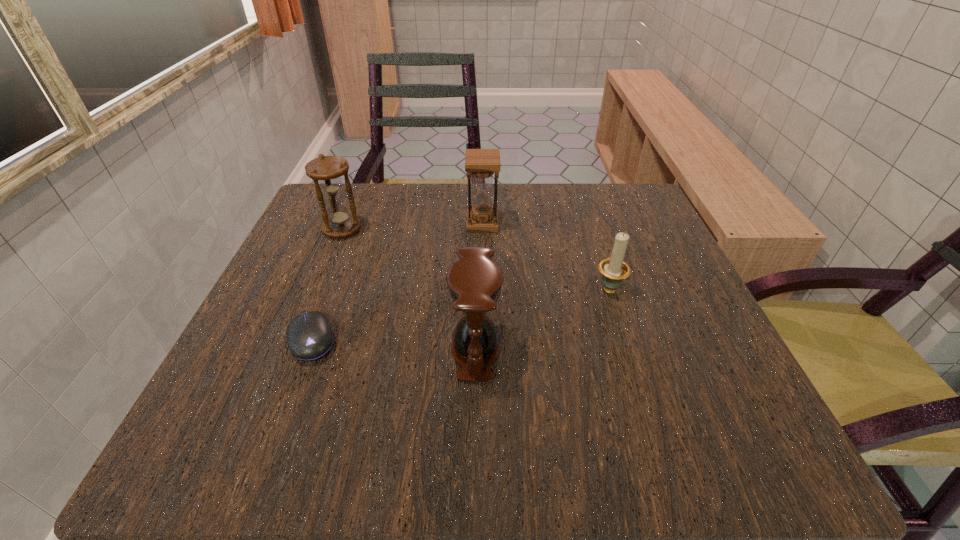
The image size is (960, 540). I want to click on blank space at the far right corner, so click(x=631, y=225).

At what (x,y) coordinates should I click in order to perform the action: click on free space between the leftmost hourglass and the nearest hourglass. Please return your answer as a coordinate pair (x, y). The height and width of the screenshot is (540, 960). Looking at the image, I should click on (409, 290).

Locate an element on the screen. empty location between the shortest object and the second shortest object is located at coordinates (460, 313).

You are a GUI agent. You are given a task and a screenshot of the screen. Output one action in this format:
    pyautogui.click(x=<x>, y=<y>)
    Task: Click on the blank region between the leftmost hourglass and the shortest object
    
    Given the screenshot: What is the action you would take?
    pyautogui.click(x=327, y=285)

Identify the location of vacant point located between the nearest hourglass and the shortest object. The image size is (960, 540). (394, 345).

Find the location of a particular element. Image resolution: width=960 pixels, height=540 pixels. vacant region between the leftmost hourglass and the shortest object is located at coordinates (327, 285).

You are a GUI agent. You are given a task and a screenshot of the screen. Output one action in this format:
    pyautogui.click(x=<x>, y=<y>)
    Task: Click on the object that stands as the closest to the shortest object
    Image resolution: width=960 pixels, height=540 pixels.
    Given the screenshot: What is the action you would take?
    pyautogui.click(x=475, y=281)

Identify the location of object that is the third nearest to the second shortest object. The height and width of the screenshot is (540, 960). (309, 336).

Find the location of `the closest hourglass to the nearest hourglass`. the closest hourglass to the nearest hourglass is located at coordinates (482, 163).

This screenshot has width=960, height=540. Find the location of `hourglass that is the third closest to the third farthest object`. hourglass that is the third closest to the third farthest object is located at coordinates (326, 171).